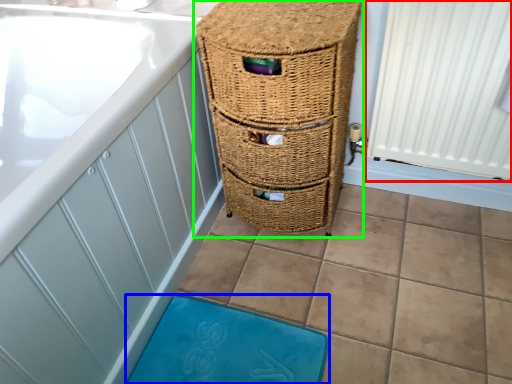
Question: Which is nearer to the radiator (highlighted by a red box)? bath mat (highlighted by a blue box) or furniture (highlighted by a green box).

Choices:
 (A) bath mat
 (B) furniture

Answer: (B)